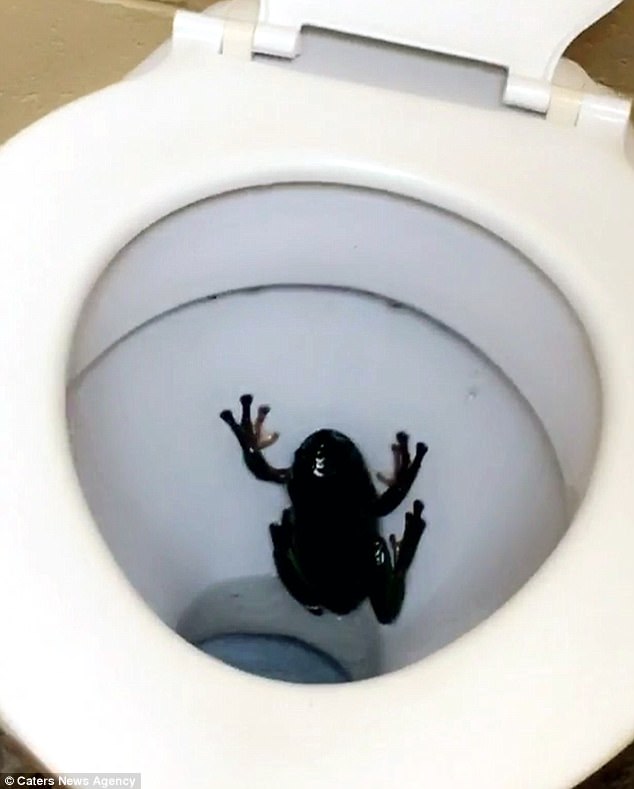
Find the location of a particular element. This screenshot has height=789, width=634. toilet bowl is located at coordinates (328, 360).